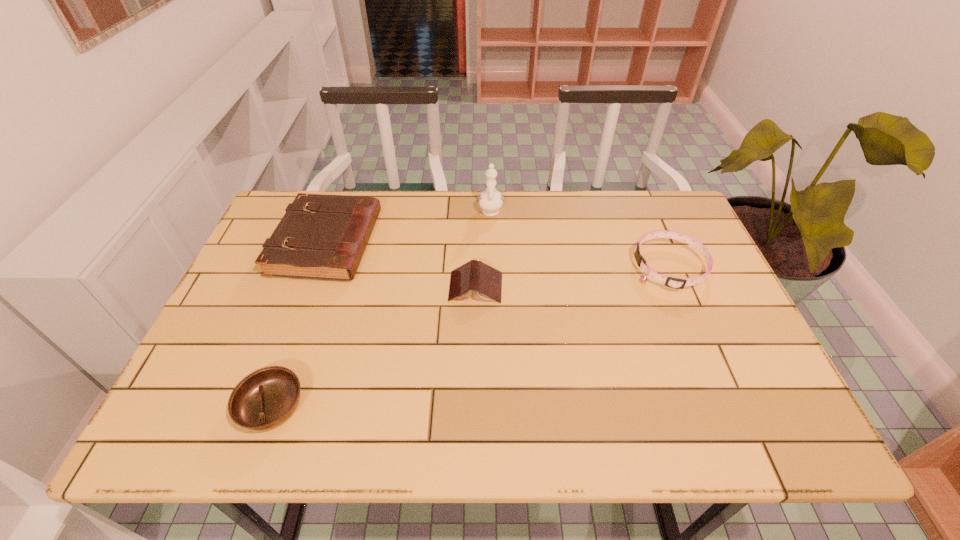
You are a GUI agent. You are given a task and a screenshot of the screen. Output one action in this format:
    pyautogui.click(x=<x>, y=<y>)
    Task: Click on the free spot at the near edge of the desktop
    The height and width of the screenshot is (540, 960).
    Given the screenshot: What is the action you would take?
    pyautogui.click(x=622, y=411)

Find the location of a particular element. vacant region at the left edge is located at coordinates (218, 398).

The image size is (960, 540). Identify the location of vacant space at the right edge of the desktop. pyautogui.click(x=697, y=326).

Locate an element on the screen. free space at the near left corner is located at coordinates (222, 436).

Where is `vacant position at the far right corner of the desktop`? vacant position at the far right corner of the desktop is located at coordinates (641, 204).

The height and width of the screenshot is (540, 960). Identify the location of vacant area that lies between the book and the chinaware. (483, 248).

Where is `free space between the dog collar and the soup bowl`? The width and height of the screenshot is (960, 540). free space between the dog collar and the soup bowl is located at coordinates (470, 337).

Locate an element on the screen. This screenshot has width=960, height=540. free space between the book and the nearest object is located at coordinates (374, 347).

Locate an element on the screen. This screenshot has width=960, height=540. unoccupied position between the soup bowl and the book is located at coordinates (374, 347).

Where is `empty space that is in between the fourth shortest object and the book`? This screenshot has width=960, height=540. empty space that is in between the fourth shortest object and the book is located at coordinates (401, 265).